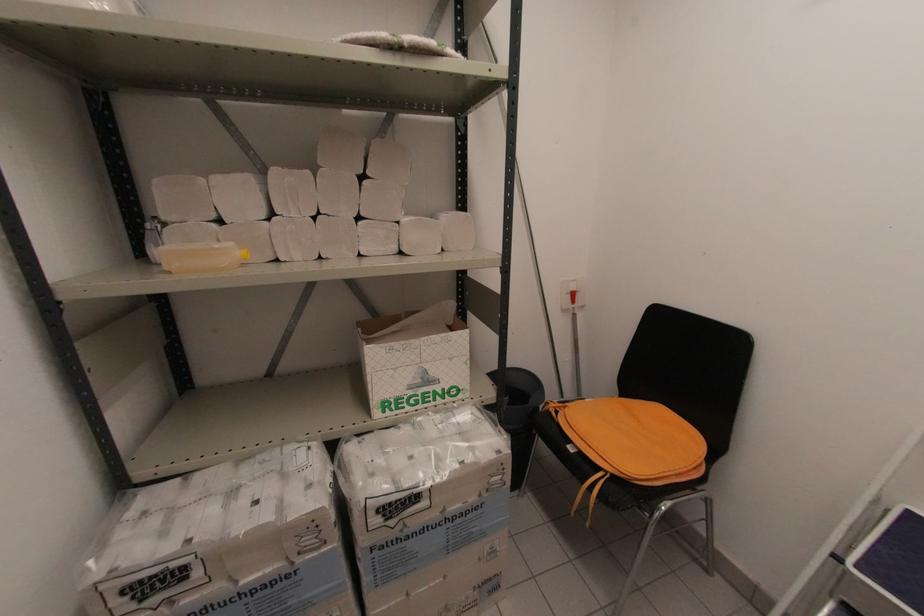
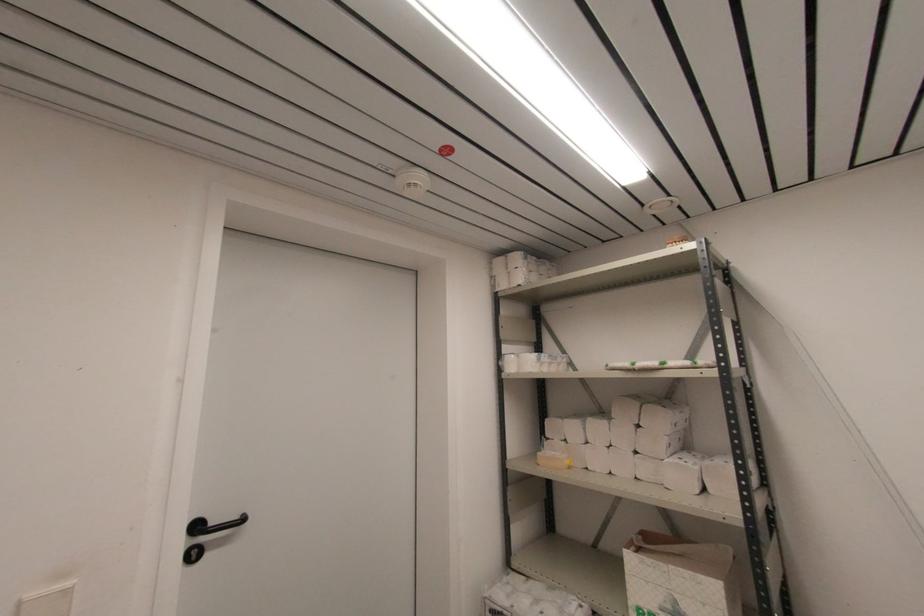
Find the pixel in the second image that matches point 419,381 in the first image.

(671, 609)